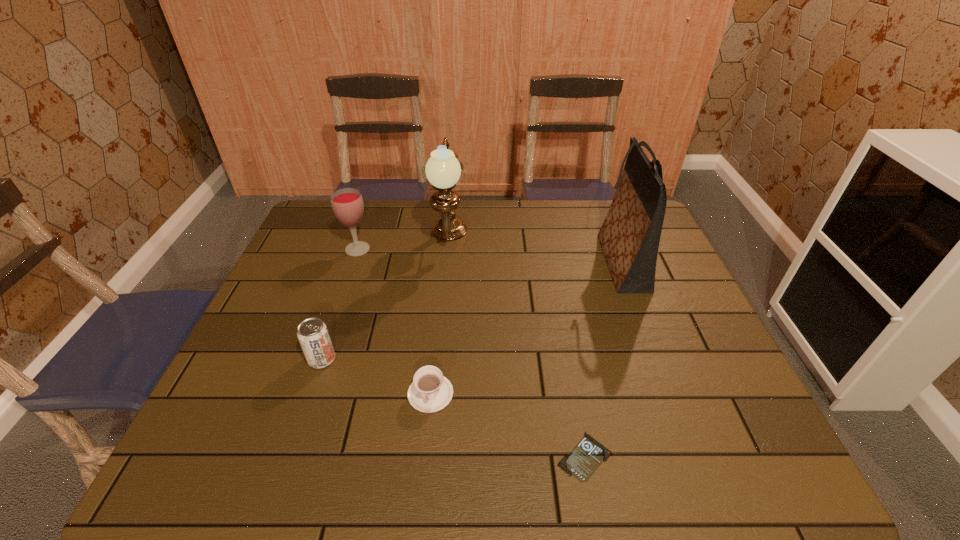
Identify the location of free space that is in between the oil lamp and the wineglass. Image resolution: width=960 pixels, height=540 pixels. (403, 245).

Image resolution: width=960 pixels, height=540 pixels. In order to click on free area in between the shopping bag and the second nearest object in this screenshot , I will do `click(526, 328)`.

Identify the location of blank region between the third shortest object and the oil lamp. (386, 300).

This screenshot has height=540, width=960. In order to click on empty space between the shopping bag and the wineglass in this screenshot , I will do `click(490, 256)`.

Locate an element on the screen. The width and height of the screenshot is (960, 540). free spot between the wineglass and the rightmost object is located at coordinates (490, 256).

What are the coordinates of `vacant space that's between the identity card and the oil lamp` in the screenshot? It's located at (516, 349).

At what (x,y) coordinates should I click in order to perform the action: click on free space between the third nearest object and the oil lamp. Please return your answer as a coordinate pair (x, y). Looking at the image, I should click on (386, 300).

You are a GUI agent. You are given a task and a screenshot of the screen. Output one action in this format:
    pyautogui.click(x=<x>, y=<y>)
    Task: Click on the vacant region between the second nearest object and the rightmost object
    
    Given the screenshot: What is the action you would take?
    pyautogui.click(x=526, y=328)

Locate an element on the screen. This screenshot has height=540, width=960. object that is the third closest to the rightmost object is located at coordinates (430, 391).

Image resolution: width=960 pixels, height=540 pixels. Find the location of `object that is the second nearest to the teacup`. object that is the second nearest to the teacup is located at coordinates (586, 457).